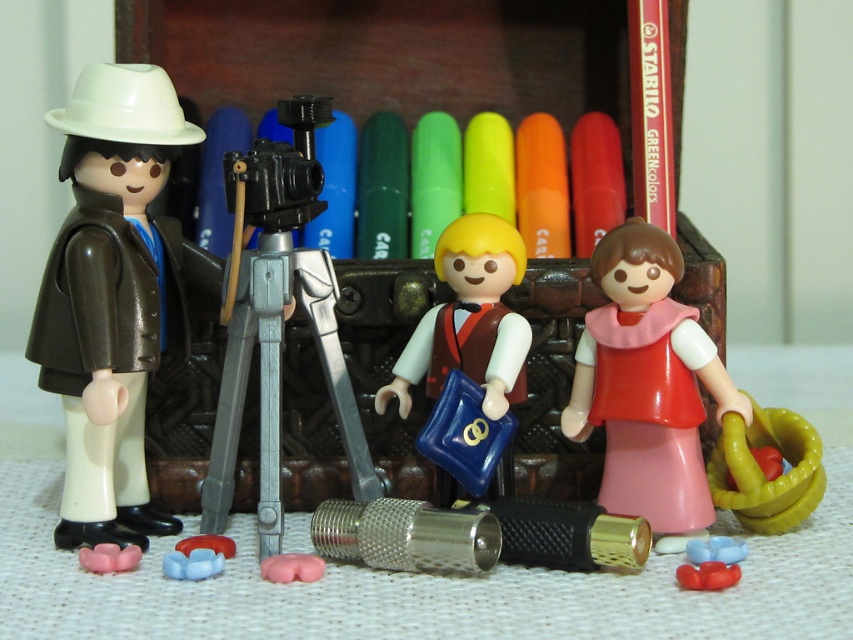
Who is taller, green rubber rings at right or pink rubber flower at lower left?

With more height is green rubber rings at right.

Is green rubber rings at right positioned behind pink rubber flower at lower left?

Yes, green rubber rings at right is further from the viewer.

Is point (811, 509) in front of point (103, 570)?

That is False.

Where is `green rubber rings at right`? The height and width of the screenshot is (640, 853). green rubber rings at right is located at coordinates (762, 470).

Does pink matte dress at center appear on the right side of pink rubber flower at lower left?

Yes, pink matte dress at center is to the right of pink rubber flower at lower left.

Which is below, pink matte dress at center or pink rubber flower at lower left?

pink rubber flower at lower left

What are the coordinates of `pink matte dress at center` in the screenshot? It's located at (647, 385).

Identify the location of pink matte dress at center. (647, 385).

Between pink matte dress at center and metallic tripod at center, which one appears on the right side from the viewer's perspective?

pink matte dress at center

Consider the image. Which is more to the left, pink matte dress at center or metallic tripod at center?

metallic tripod at center

Between point (612, 512) and point (247, 380), which one is positioned in front?

Point (612, 512) is more forward.

Where is `pink matte dress at center`? Image resolution: width=853 pixels, height=640 pixels. pink matte dress at center is located at coordinates (647, 385).